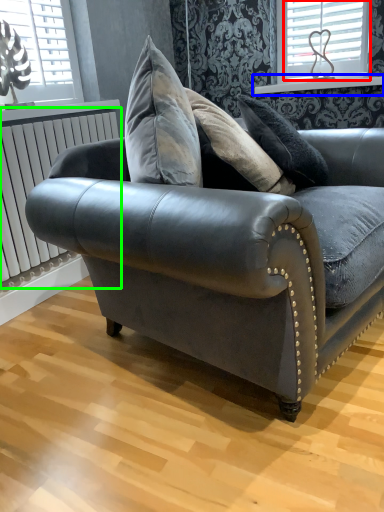
Question: Which object is the farthest from window (highlighted by a red box)? Choose among these: window sill (highlighted by a blue box) or radiator (highlighted by a green box).

Choices:
 (A) window sill
 (B) radiator

Answer: (B)